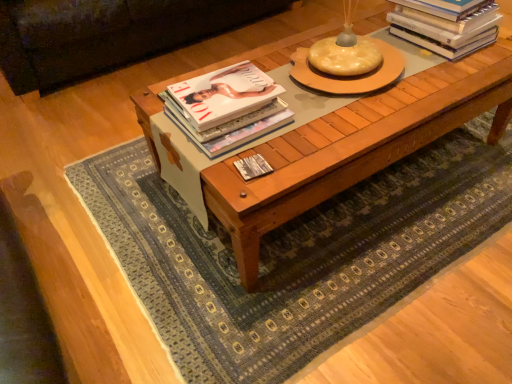
Question: Is matte hardcover book at center, which is the 3th book in right-to-left order, positioned in front of wooden coffee table at center?

Choices:
 (A) yes
 (B) no

Answer: (B)

Question: Considering the relative sizes of matte hardcover book at center, which is the 3th book in right-to-left order, and wooden coffee table at center in the image provided, is matte hardcover book at center, which is the 3th book in right-to-left order, wider than wooden coffee table at center?

Choices:
 (A) no
 (B) yes

Answer: (A)

Question: Is matte hardcover book at center, the second book from the bottom, to the left of wooden coffee table at center from the viewer's perspective?

Choices:
 (A) yes
 (B) no

Answer: (A)

Question: From the image's perspective, is matte hardcover book at center, the second book from the bottom, on top of wooden coffee table at center?

Choices:
 (A) yes
 (B) no

Answer: (B)

Question: Can you confirm if matte hardcover book at center, the second book from the bottom, is thinner than wooden coffee table at center?

Choices:
 (A) no
 (B) yes

Answer: (B)

Question: Does matte hardcover book at center, placed as the second book when sorted from top to bottom, appear on the right side of wooden coffee table at center?

Choices:
 (A) no
 (B) yes

Answer: (A)

Question: Would you say hardcover books at upper right, marked as the third book in a bottom-to-top arrangement, is outside matte hardcover book at center, the second book from the bottom?

Choices:
 (A) no
 (B) yes

Answer: (B)

Question: Are hardcover books at upper right, acting as the 3th book starting from the left, and matte hardcover book at center, which appears as the 1th book when viewed from the left, located far from each other?

Choices:
 (A) yes
 (B) no

Answer: (B)

Question: Is hardcover books at upper right, positioned as the 1th book in right-to-left order, oriented away from matte hardcover book at center, the second book from the bottom?

Choices:
 (A) yes
 (B) no

Answer: (B)

Question: Is hardcover books at upper right, acting as the 3th book starting from the left, taller than matte hardcover book at center, which is the 3th book in right-to-left order?

Choices:
 (A) yes
 (B) no

Answer: (A)

Question: Does hardcover books at upper right, positioned as the 1th book in right-to-left order, contain matte hardcover book at center, which appears as the 1th book when viewed from the left?

Choices:
 (A) yes
 (B) no

Answer: (B)

Question: Is hardcover books at upper right, marked as the third book in a bottom-to-top arrangement, to the left of matte hardcover book at center, which appears as the 1th book when viewed from the left, from the viewer's perspective?

Choices:
 (A) no
 (B) yes

Answer: (A)

Question: Is matte hardcover book at center, which appears as the 1th book when viewed from the left, positioned beyond the bounds of white glossy book at center, placed as the 2th book when sorted from left to right?

Choices:
 (A) yes
 (B) no

Answer: (A)